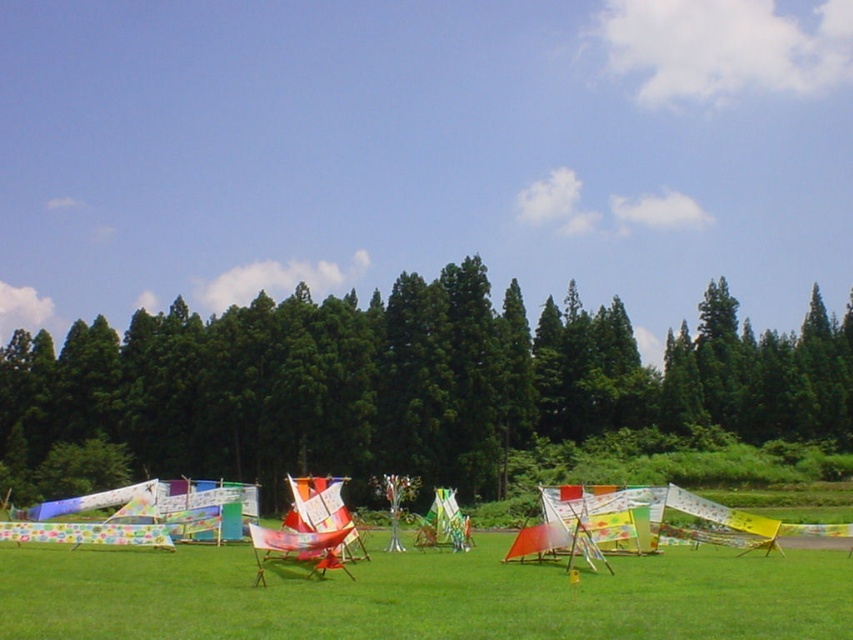
Question: Does green leafy tree at center have a larger size compared to green grassy at center?

Choices:
 (A) no
 (B) yes

Answer: (B)

Question: Among these points, which one is farthest from the camera?

Choices:
 (A) [x=817, y=388]
 (B) [x=740, y=618]

Answer: (A)

Question: Is green leafy tree at center to the left of green grassy at center from the viewer's perspective?

Choices:
 (A) yes
 (B) no

Answer: (B)

Question: Which of the following is the farthest from the observer?

Choices:
 (A) green leafy tree at center
 (B) green grassy at center

Answer: (A)

Question: Is green leafy tree at center in front of green grassy at center?

Choices:
 (A) no
 (B) yes

Answer: (A)

Question: Among these points, which one is nearest to the camera?

Choices:
 (A) (515, 392)
 (B) (627, 598)

Answer: (B)